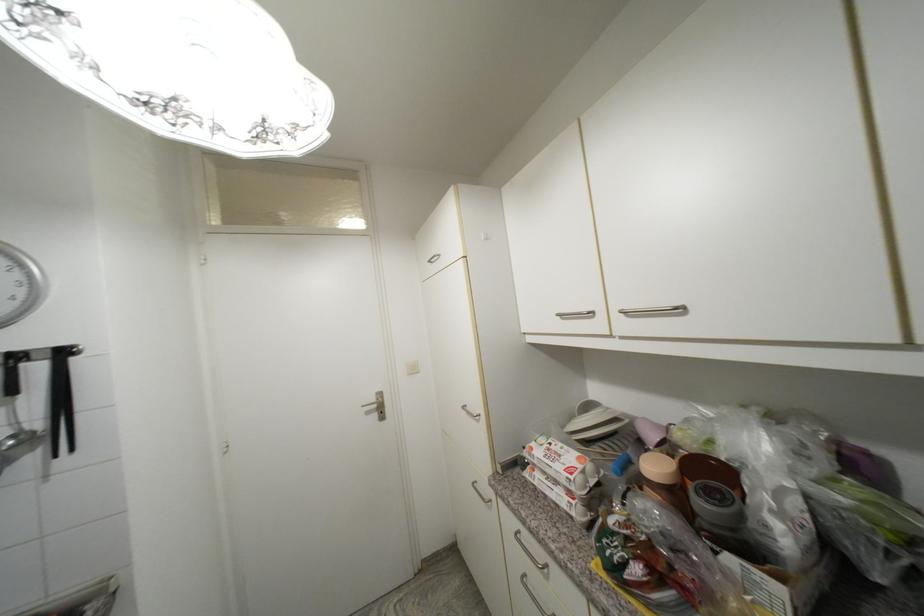
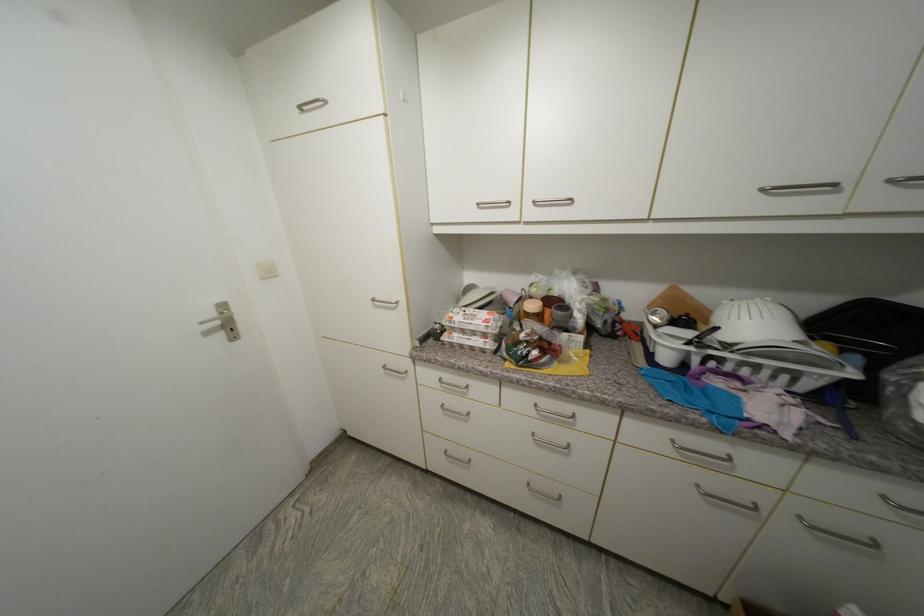
The point at (x=435, y=262) is marked in the first image. Where is the corresponding point in the second image?

(307, 108)